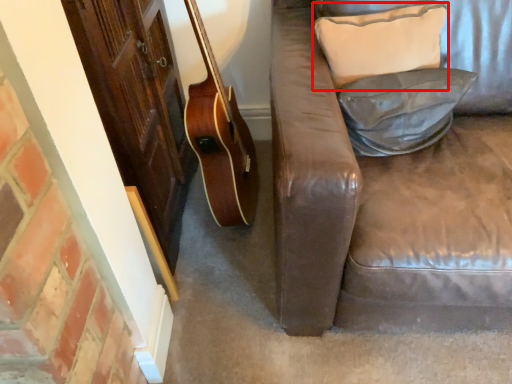
Question: From the image's perspective, where is pillow (annotated by the red box) located in relation to pillow in the image?

Choices:
 (A) above
 (B) below

Answer: (A)